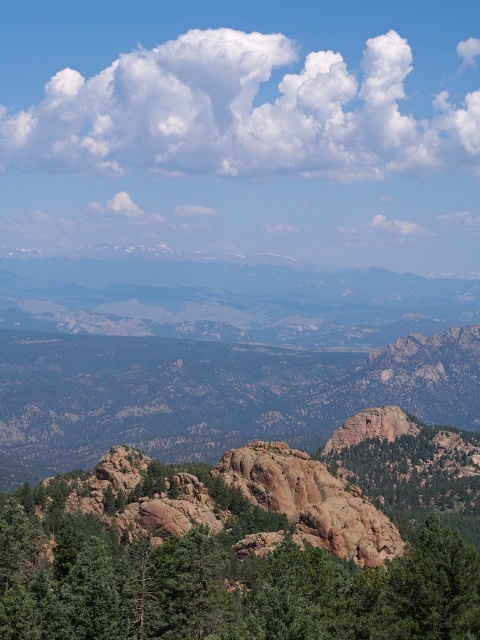
Question: Observing the image, what is the correct spatial positioning of green textured rock at center in reference to rocky mountain range at center?

Choices:
 (A) below
 (B) above

Answer: (A)

Question: Estimate the real-world distances between objects in this image. Which object is closer to the green textured rock at center?

Choices:
 (A) white fluffy cloud at upper center
 (B) rocky mountain range at center

Answer: (B)

Question: Which point is farther to the camera?

Choices:
 (A) (402, 164)
 (B) (130, 595)
 (C) (365, 308)

Answer: (A)

Question: Can you confirm if green textured rock at center is positioned below rocky mountain range at center?

Choices:
 (A) yes
 (B) no

Answer: (A)

Question: Does green textured rock at center appear on the left side of rocky mountain range at center?

Choices:
 (A) no
 (B) yes

Answer: (A)

Question: Estimate the real-world distances between objects in this image. Which object is farther from the green textured rock at center?

Choices:
 (A) rocky mountain range at center
 (B) white fluffy cloud at upper center

Answer: (B)